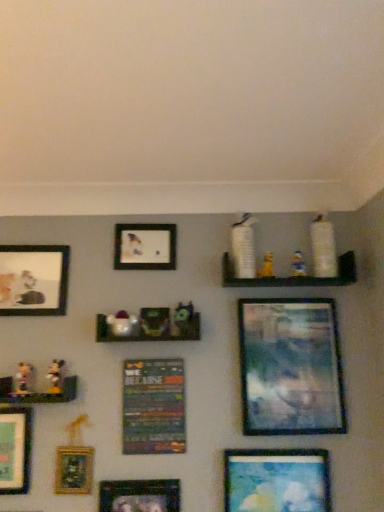
Question: Considering the relative sizes of yellow fabric toy at upper center, arranged as the sixth toy when viewed from the left, and matte black picture frame at upper center, the 4th picture frame when ordered from right to left, in the image provided, is yellow fabric toy at upper center, arranged as the sixth toy when viewed from the left, smaller than matte black picture frame at upper center, the 4th picture frame when ordered from right to left,?

Choices:
 (A) yes
 (B) no

Answer: (A)

Question: Is yellow fabric toy at upper center, arranged as the sixth toy when viewed from the left, at the left side of matte black picture frame at upper center, which is counted as the fifth picture frame, starting from the left?

Choices:
 (A) no
 (B) yes

Answer: (A)

Question: Does yellow fabric toy at upper center, arranged as the sixth toy when viewed from the left, have a greater height compared to matte black picture frame at upper center, which is counted as the fifth picture frame, starting from the left?

Choices:
 (A) yes
 (B) no

Answer: (B)

Question: From the image's perspective, does yellow fabric toy at upper center, arranged as the sixth toy when viewed from the left, appear lower than matte black picture frame at upper center, which is counted as the fifth picture frame, starting from the left?

Choices:
 (A) yes
 (B) no

Answer: (A)

Question: From a real-world perspective, is yellow fabric toy at upper center, arranged as the sixth toy when viewed from the left, below matte black picture frame at upper center, the 4th picture frame when ordered from right to left?

Choices:
 (A) no
 (B) yes

Answer: (B)

Question: Is yellow fabric toy at upper center, arranged as the sixth toy when viewed from the left, shorter than matte black picture frame at upper center, which is counted as the fifth picture frame, starting from the left?

Choices:
 (A) no
 (B) yes

Answer: (B)

Question: From a real-world perspective, is matte plastic toy at center, the fifth toy viewed from the right, on top of white matte shelf at upper center, the third shelf from the left?

Choices:
 (A) yes
 (B) no

Answer: (B)

Question: From the image's perspective, is matte plastic toy at center, the 3th toy positioned from the left, below white matte shelf at upper center, the first shelf when ordered from top to bottom?

Choices:
 (A) no
 (B) yes

Answer: (B)

Question: Does matte plastic toy at center, the fifth toy viewed from the right, touch white matte shelf at upper center, which is the 3th shelf from bottom to top?

Choices:
 (A) yes
 (B) no

Answer: (B)

Question: From a real-world perspective, is matte plastic toy at center, the fifth toy viewed from the right, physically below white matte shelf at upper center, the third shelf from the left?

Choices:
 (A) yes
 (B) no

Answer: (A)

Question: Considering the relative sizes of matte plastic toy at center, the fifth toy viewed from the right, and white matte shelf at upper center, the third shelf from the left, in the image provided, is matte plastic toy at center, the fifth toy viewed from the right, wider than white matte shelf at upper center, the third shelf from the left,?

Choices:
 (A) no
 (B) yes

Answer: (A)

Question: Is matte blue painting at lower right, acting as the 7th picture frame starting from the left, turned away from matte green picture frame at lower left, the first picture frame positioned from the left?

Choices:
 (A) yes
 (B) no

Answer: (B)